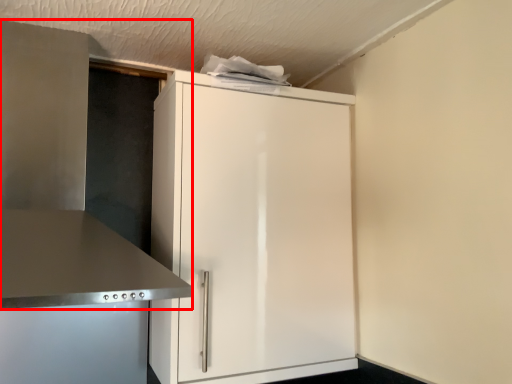
Question: Where is vent (annotated by the red box) located in relation to cupboard in the image?

Choices:
 (A) left
 (B) right

Answer: (A)